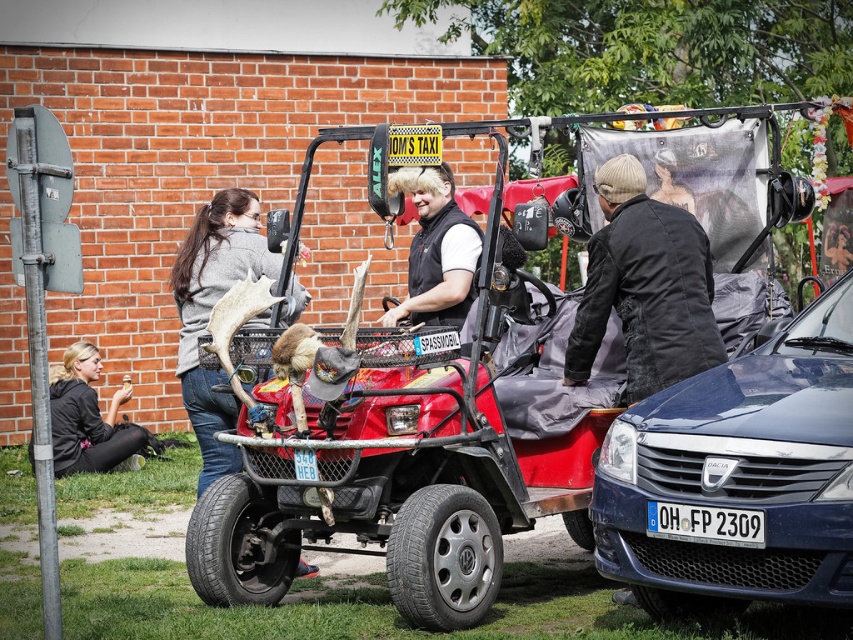
Can you confirm if red matte jeep at center is wider than gray sweater at left?

Correct, the width of red matte jeep at center exceeds that of gray sweater at left.

What do you see at coordinates (387, 483) in the screenshot? I see `red matte jeep at center` at bounding box center [387, 483].

The width and height of the screenshot is (853, 640). In order to click on red matte jeep at center in this screenshot , I will do `click(387, 483)`.

Which of these two, blue metallic car at lower right or distressed black jacket at center, stands shorter?

distressed black jacket at center

Which of these two, blue metallic car at lower right or distressed black jacket at center, stands taller?

blue metallic car at lower right

Is point (636, 435) more distant than point (677, 342)?

No, (636, 435) is closer to viewer.

Find the location of `blue metallic car at lower right`. blue metallic car at lower right is located at coordinates (738, 476).

In the scene shown: Does red matte jeep at center have a lesser width compared to matte black jacket at upper center?

No.

Is red matte jeep at center above matte black jacket at upper center?

Incorrect, red matte jeep at center is not positioned above matte black jacket at upper center.

Does point (527, 460) lie in front of point (675, 168)?

Yes, point (527, 460) is in front of point (675, 168).

Locate an element on the screen. The image size is (853, 640). red matte jeep at center is located at coordinates (387, 483).